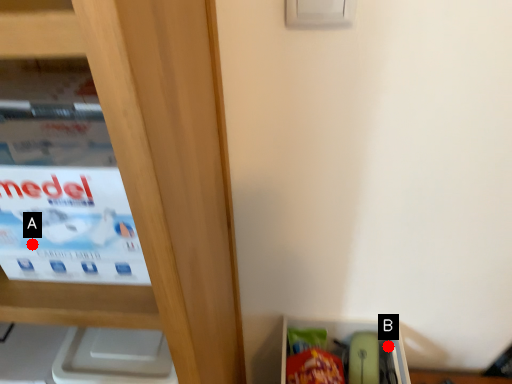
Question: Two points are circled on the image, labeled by A and B beside each circle. Which of the following is the closest to the observer?

Choices:
 (A) A is closer
 (B) B is closer

Answer: (A)